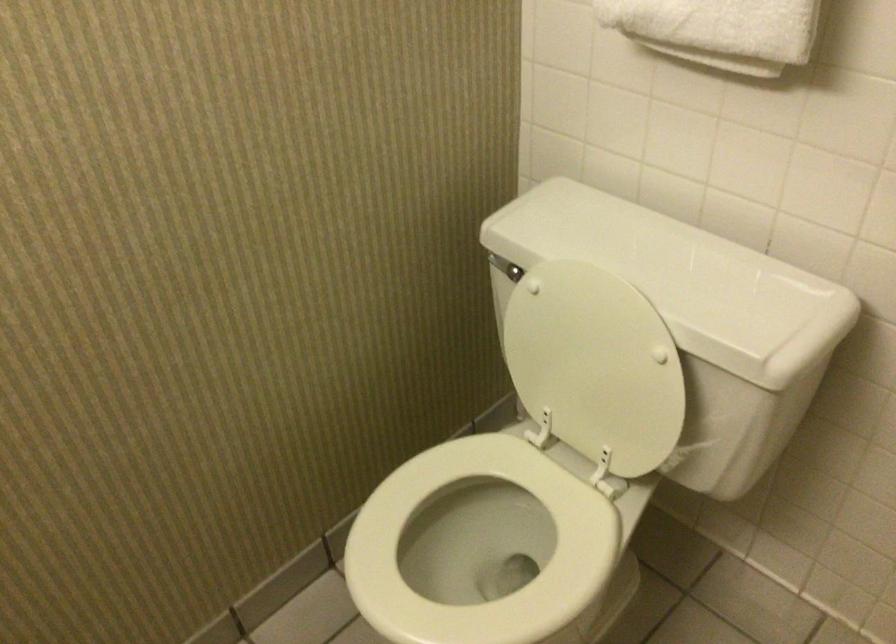
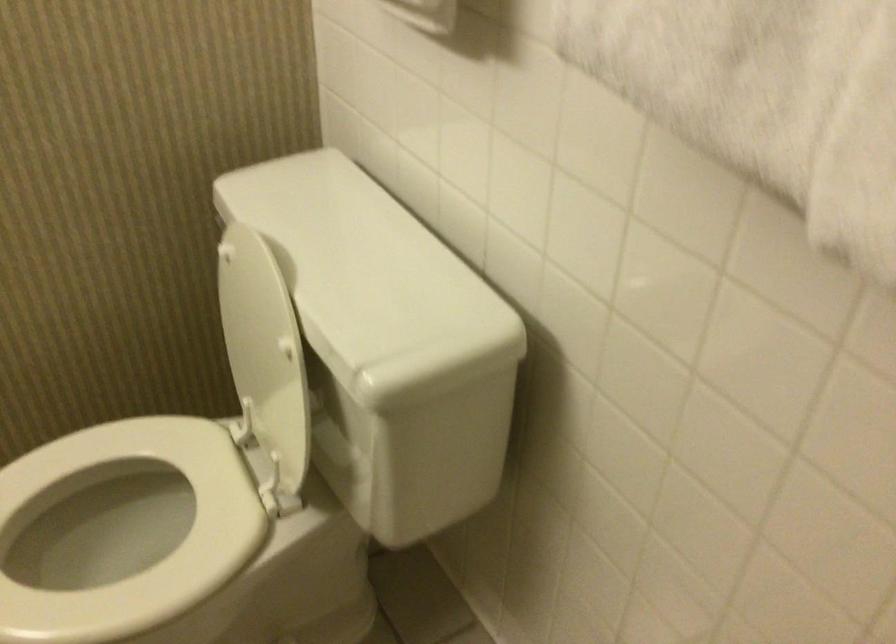
The point at (x=596, y=357) is marked in the first image. Where is the corresponding point in the second image?

(259, 343)